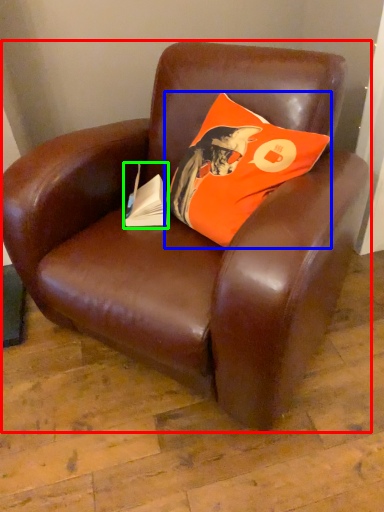
Question: Considering the real-world distances, which object is farthest from chair (highlighted by a red box)? pillow (highlighted by a blue box) or paperback book (highlighted by a green box)?

Choices:
 (A) pillow
 (B) paperback book

Answer: (B)